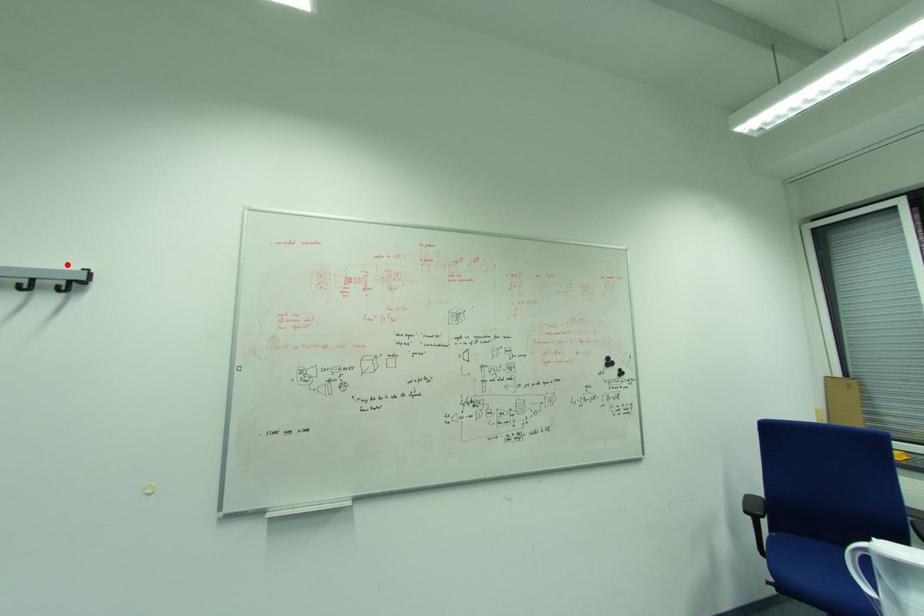
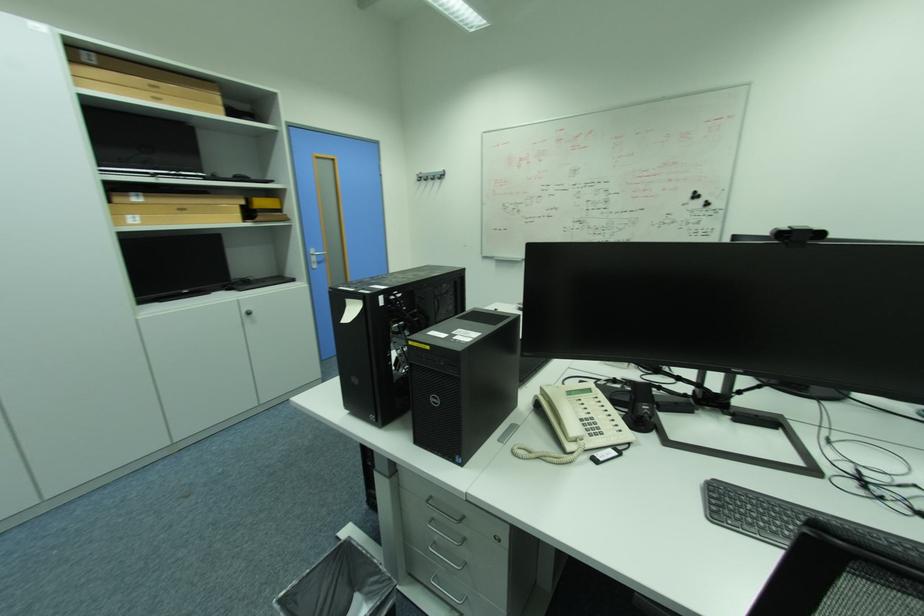
The point at the highlighted location is marked in the first image. Where is the corresponding point in the second image?

(444, 169)